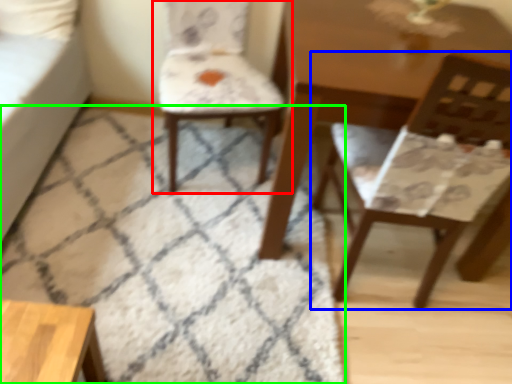
Question: Based on their relative distances, which object is nearer to chair (highlighted by a red box)? Choose from chair (highlighted by a blue box) and mat (highlighted by a green box).

Choices:
 (A) chair
 (B) mat

Answer: (B)